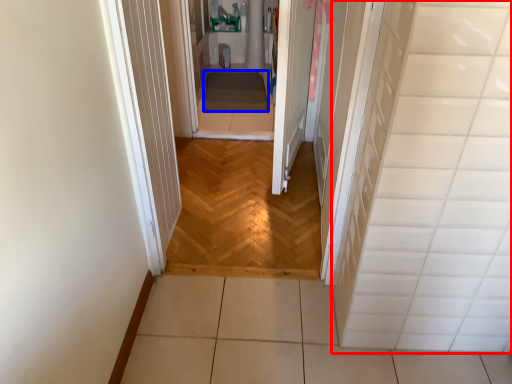
Question: Which object appears farthest to the camera in this image, tile (highlighted by a red box) or blanket (highlighted by a blue box)?

Choices:
 (A) tile
 (B) blanket

Answer: (B)